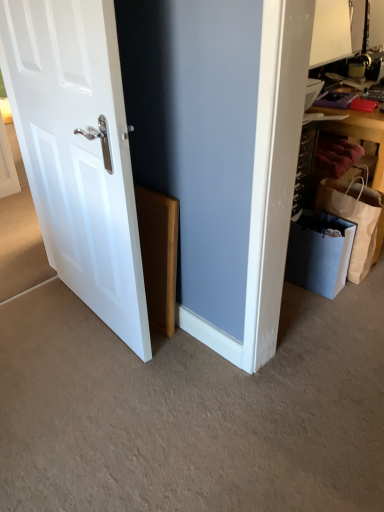
Question: Is white glossy door at left not inside white paper shopping bag at right?

Choices:
 (A) no
 (B) yes

Answer: (B)

Question: Does white glossy door at left have a lesser width compared to white paper shopping bag at right?

Choices:
 (A) yes
 (B) no

Answer: (A)

Question: Could you tell me if white glossy door at left is facing white paper shopping bag at right?

Choices:
 (A) no
 (B) yes

Answer: (A)

Question: Is white glossy door at left to the left of white paper shopping bag at right from the viewer's perspective?

Choices:
 (A) yes
 (B) no

Answer: (A)

Question: Does white glossy door at left appear on the right side of white paper shopping bag at right?

Choices:
 (A) yes
 (B) no

Answer: (B)

Question: Can you confirm if white glossy door at left is bigger than white paper shopping bag at right?

Choices:
 (A) yes
 (B) no

Answer: (A)

Question: From the image's perspective, is white paper shopping bag at right over white glossy door at left?

Choices:
 (A) no
 (B) yes

Answer: (A)

Question: Can you confirm if white paper shopping bag at right is positioned to the right of white glossy door at left?

Choices:
 (A) no
 (B) yes

Answer: (B)

Question: Does white paper shopping bag at right have a larger size compared to white glossy door at left?

Choices:
 (A) no
 (B) yes

Answer: (A)

Question: Is white paper shopping bag at right shorter than white glossy door at left?

Choices:
 (A) yes
 (B) no

Answer: (A)

Question: Is white paper shopping bag at right to the left of white glossy door at left from the viewer's perspective?

Choices:
 (A) yes
 (B) no

Answer: (B)

Question: Is the position of white paper shopping bag at right more distant than that of white glossy door at left?

Choices:
 (A) yes
 (B) no

Answer: (A)

Question: Is point (109, 123) closer or farther from the camera than point (349, 267)?

Choices:
 (A) farther
 (B) closer

Answer: (B)